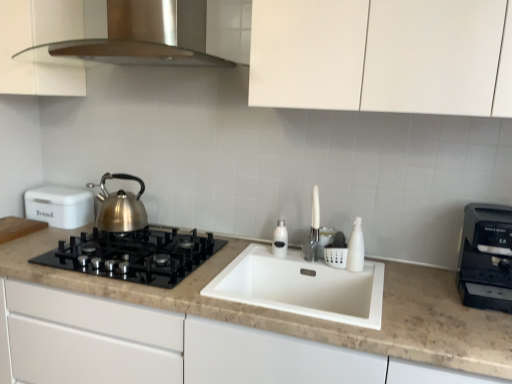
Find the location of a particular element. This screenshot has width=512, height=384. vacant area located to the right-hand side of satin silver soap dispenser at sink, the 2th bottle when ordered from right to left is located at coordinates (303, 258).